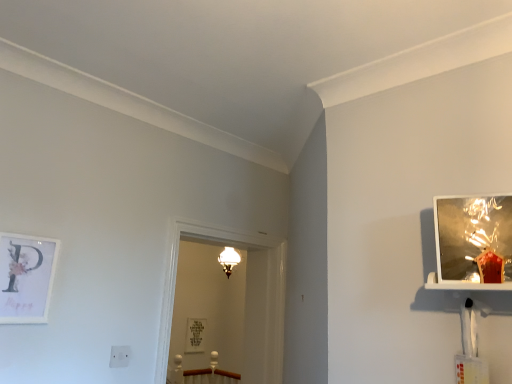
Question: From the image's perspective, is metallic reflective picture frame at upper right, acting as the first picture frame starting from the right, located beneath white matte picture frame at left, acting as the 2th picture frame starting from the back?

Choices:
 (A) yes
 (B) no

Answer: (B)

Question: Considering the relative sizes of metallic reflective picture frame at upper right, which ranks as the 3th picture frame in left-to-right order, and white matte picture frame at left, the 2th picture frame in the bottom-to-top sequence, in the image provided, is metallic reflective picture frame at upper right, which ranks as the 3th picture frame in left-to-right order, smaller than white matte picture frame at left, the 2th picture frame in the bottom-to-top sequence,?

Choices:
 (A) no
 (B) yes

Answer: (A)

Question: Is metallic reflective picture frame at upper right, which ranks as the 3th picture frame in left-to-right order, thinner than white matte picture frame at left, which is the first picture frame in left-to-right order?

Choices:
 (A) no
 (B) yes

Answer: (A)

Question: From a real-world perspective, is metallic reflective picture frame at upper right, the third picture frame when ordered from bottom to top, positioned under white matte picture frame at left, which is the second picture frame from front to back, based on gravity?

Choices:
 (A) no
 (B) yes

Answer: (A)

Question: Is metallic reflective picture frame at upper right, which appears as the 1th picture frame when viewed from the top, taller than white matte picture frame at left, which is the second picture frame from front to back?

Choices:
 (A) no
 (B) yes

Answer: (A)

Question: Is metallic reflective picture frame at upper right, which ranks as the 3th picture frame in left-to-right order, shorter than white matte picture frame at left, acting as the 2th picture frame starting from the back?

Choices:
 (A) no
 (B) yes

Answer: (B)

Question: Is white matte picture frame at left, which is the second picture frame from front to back, shorter than metallic reflective picture frame at upper right, which appears as the 1th picture frame when viewed from the top?

Choices:
 (A) yes
 (B) no

Answer: (B)

Question: Can you confirm if white matte picture frame at left, the 2th picture frame in the bottom-to-top sequence, is bigger than metallic reflective picture frame at upper right, which ranks as the 3th picture frame in left-to-right order?

Choices:
 (A) no
 (B) yes

Answer: (A)

Question: Is white matte picture frame at left, acting as the 2th picture frame starting from the back, smaller than metallic reflective picture frame at upper right, positioned as the first picture frame in front-to-back order?

Choices:
 (A) no
 (B) yes

Answer: (B)

Question: From the image's perspective, is white matte picture frame at left, acting as the 2th picture frame starting from the back, under metallic reflective picture frame at upper right, positioned as the first picture frame in front-to-back order?

Choices:
 (A) no
 (B) yes

Answer: (B)

Question: Is white matte picture frame at left, which is the second picture frame from front to back, outside of metallic reflective picture frame at upper right, which appears as the 1th picture frame when viewed from the top?

Choices:
 (A) yes
 (B) no

Answer: (A)

Question: Is white matte picture frame at left, the 2th picture frame in the bottom-to-top sequence, at the right side of metallic reflective picture frame at upper right, positioned as the 3th picture frame in back-to-front order?

Choices:
 (A) no
 (B) yes

Answer: (A)

Question: Is white matte picture frame at left, which is the second picture frame from front to back, positioned behind matte silver picture frame at center, which is counted as the second picture frame, starting from the right?

Choices:
 (A) yes
 (B) no

Answer: (B)